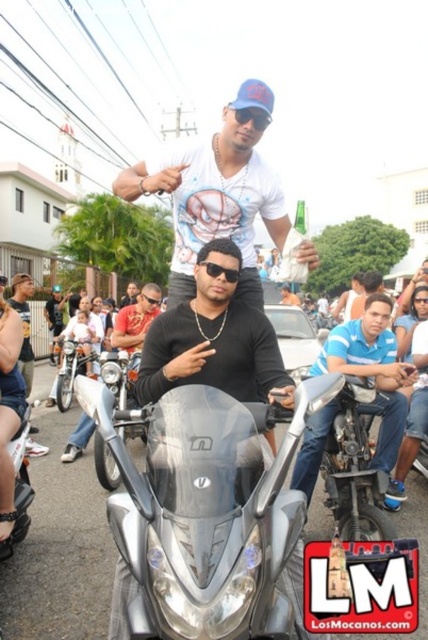
Looking at this image, can you confirm if white printed t-shirt at center is positioned above sleek silver motorcycle at center?

Yes, white printed t-shirt at center is above sleek silver motorcycle at center.

Does point (214, 234) come farther from viewer compared to point (20, 458)?

No, it is in front of (20, 458).

Between point (190, 193) and point (23, 422), which one is positioned behind?

Point (23, 422)

Where is `white printed t-shirt at center`? white printed t-shirt at center is located at coordinates (216, 193).

Can you confirm if white printed t-shirt at center is thinner than black leather jacket at center?

In fact, white printed t-shirt at center might be wider than black leather jacket at center.

Does white printed t-shirt at center have a lesser height compared to black leather jacket at center?

In fact, white printed t-shirt at center may be taller than black leather jacket at center.

Who is more forward, (157, 184) or (131, 333)?

Positioned in front is point (157, 184).

Locate an element on the screen. The image size is (428, 640). white printed t-shirt at center is located at coordinates (216, 193).

Can you confirm if silver metallic motorcycle at center is positioned above sleek silver motorcycle at center?

Correct, silver metallic motorcycle at center is located above sleek silver motorcycle at center.

Is point (162, 589) positioned in front of point (17, 490)?

Yes.

I want to click on silver metallic motorcycle at center, so click(x=205, y=515).